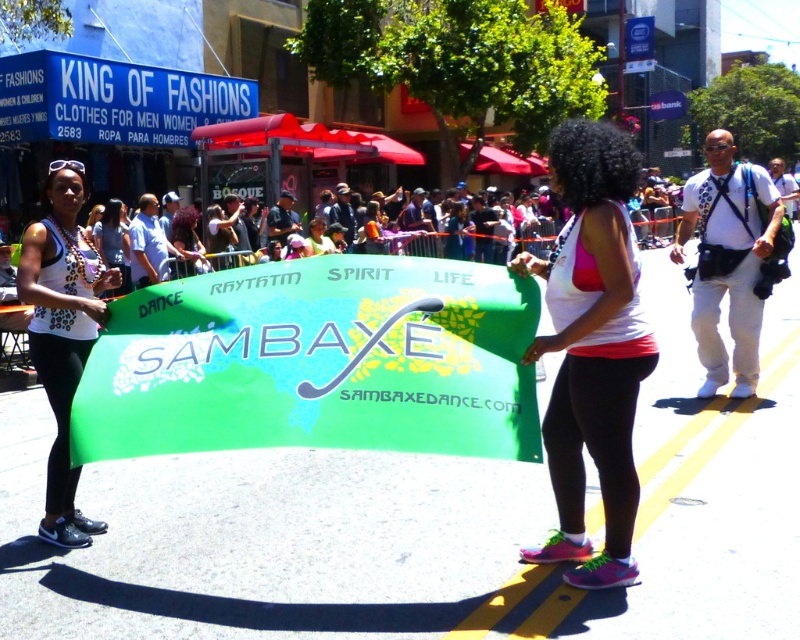
Between white matte tank top at center and matte black tank top at center, which one has less height?

white matte tank top at center is shorter.

This screenshot has width=800, height=640. Describe the element at coordinates (592, 348) in the screenshot. I see `white matte tank top at center` at that location.

Which is behind, point (548, 262) or point (192, 212)?

The point (192, 212) is more distant.

This screenshot has height=640, width=800. I want to click on white matte tank top at center, so click(592, 348).

Which is more to the right, white matte tank top at center or white leopard print tank top at left?

white matte tank top at center is more to the right.

Is white matte tank top at center below white leopard print tank top at left?

Indeed, white matte tank top at center is positioned under white leopard print tank top at left.

Is point (560, 488) positioned before point (78, 296)?

Yes.

This screenshot has height=640, width=800. In order to click on white matte tank top at center in this screenshot , I will do `click(592, 348)`.

Between point (52, 333) and point (208, 266), which one is positioned in front?

Point (52, 333) is in front.

Which is above, white leopard print tank top at left or matte black tank top at center?

Positioned higher is matte black tank top at center.

Locate an element on the screen. white leopard print tank top at left is located at coordinates (62, 332).